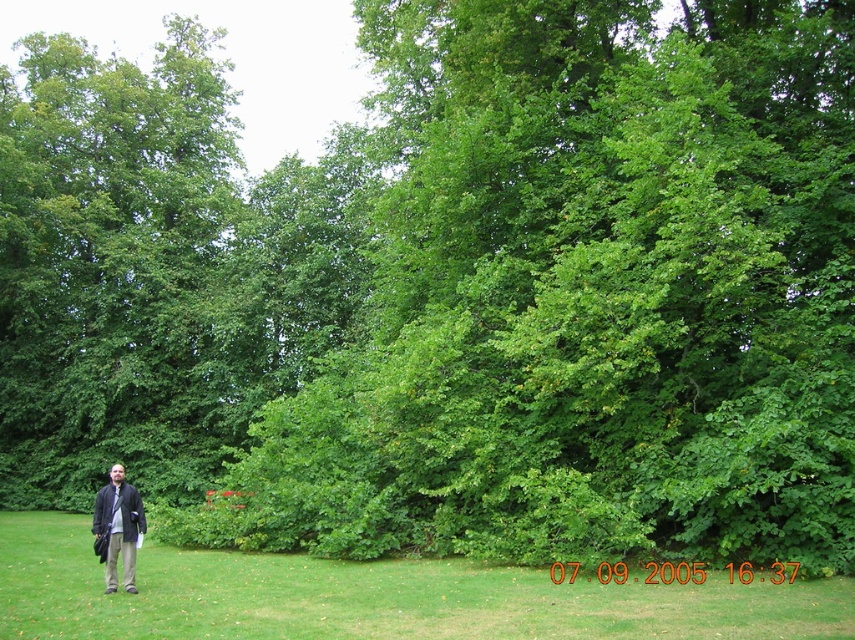
Question: Is green grass at left above dark gray wool coat at lower left?

Choices:
 (A) no
 (B) yes

Answer: (A)

Question: Which of the following is the farthest from the observer?

Choices:
 (A) green grass at left
 (B) dark gray wool coat at lower left

Answer: (B)

Question: Does green grass at left appear under dark gray wool coat at lower left?

Choices:
 (A) yes
 (B) no

Answer: (A)

Question: Which object appears farthest from the camera in this image?

Choices:
 (A) green grass at left
 (B) dark gray wool coat at lower left

Answer: (B)

Question: Observing the image, what is the correct spatial positioning of green grass at left in reference to dark gray wool coat at lower left?

Choices:
 (A) right
 (B) left

Answer: (A)